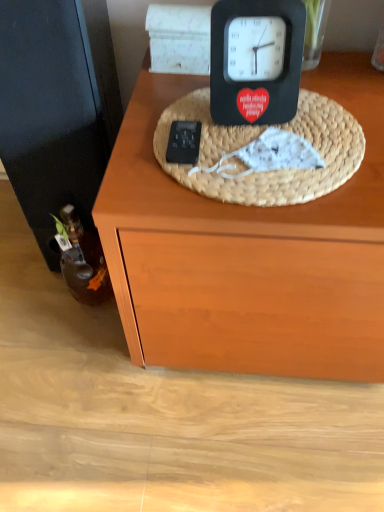
Identify the location of vacant area in front of brown glass bottle at left. The height and width of the screenshot is (512, 384). (74, 350).